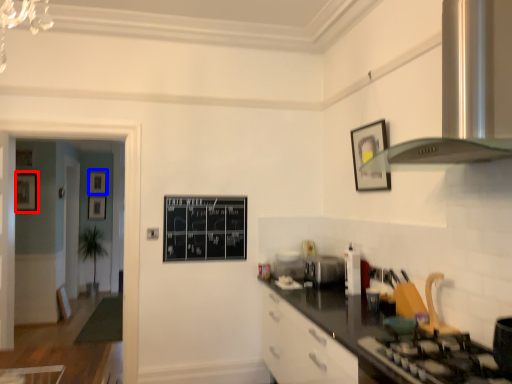
Question: Which object appears farthest to the camera in this image, picture frame (highlighted by a red box) or picture frame (highlighted by a blue box)?

Choices:
 (A) picture frame
 (B) picture frame

Answer: (B)